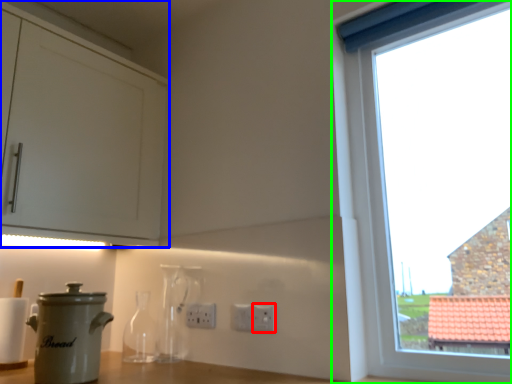
Question: Which object is the closest to the electric outlet (highlighted by a red box)? Choose among these: cabinetry (highlighted by a blue box) or window (highlighted by a green box).

Choices:
 (A) cabinetry
 (B) window

Answer: (B)